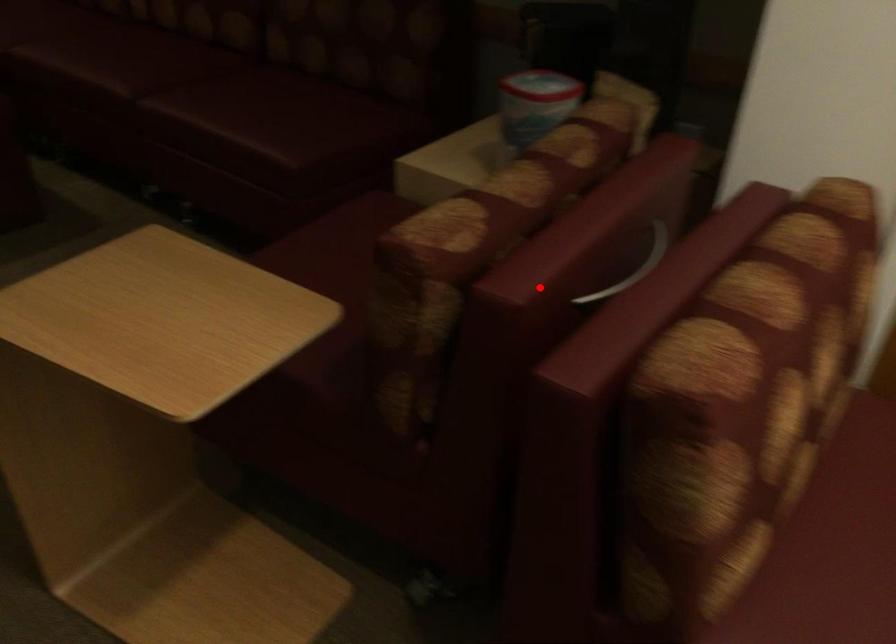
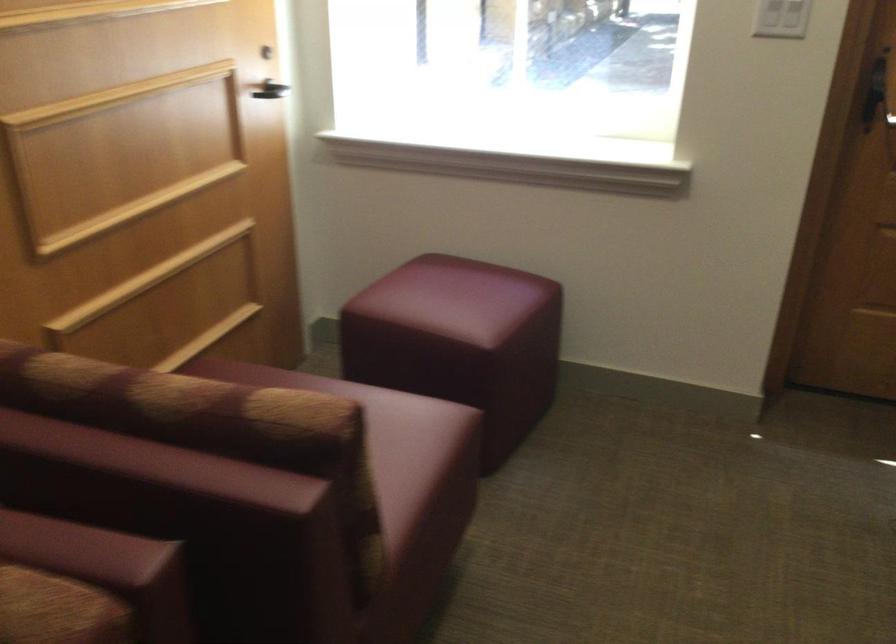
Question: I am providing you with two images of the same scene from different viewpoints. A red point is shown in image1. For the corresponding object point in image2, is it positioned nearer or farther from the camera?

Choices:
 (A) Nearer
 (B) Farther

Answer: (A)